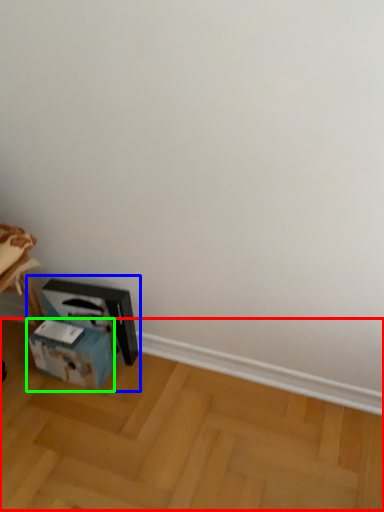
Question: Considering the real-world distances, which object is farthest from wood (highlighted by a red box)? workbench (highlighted by a blue box) or box (highlighted by a green box)?

Choices:
 (A) workbench
 (B) box

Answer: (B)